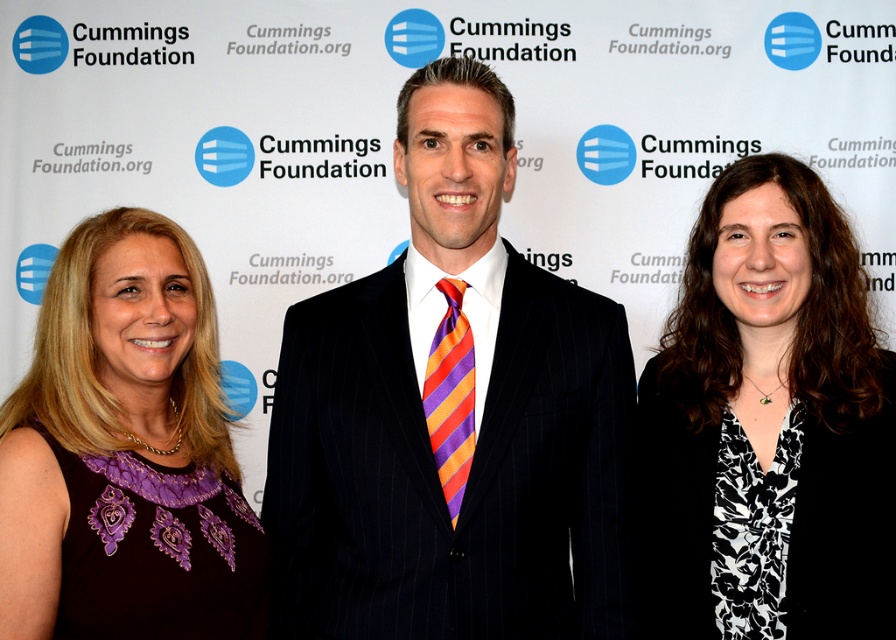
Between black pinstripe suit at center and purple embroidered dress at left, which one has less height?

With less height is purple embroidered dress at left.

Is point (376, 499) farther from camera compared to point (109, 426)?

Yes, it is.

The height and width of the screenshot is (640, 896). What do you see at coordinates (451, 416) in the screenshot? I see `black pinstripe suit at center` at bounding box center [451, 416].

In order to click on black pinstripe suit at center in this screenshot , I will do `click(451, 416)`.

The height and width of the screenshot is (640, 896). Identify the location of black floral dress at right. (768, 426).

Is point (866, 492) farther from camera compared to point (187, 513)?

Yes, it is behind point (187, 513).

This screenshot has width=896, height=640. I want to click on black floral dress at right, so click(x=768, y=426).

Does purple embroidered dress at left appear on the right side of orange and purple striped tie at center?

Incorrect, purple embroidered dress at left is not on the right side of orange and purple striped tie at center.

Is purple embroidered dress at left above orange and purple striped tie at center?

Incorrect, purple embroidered dress at left is not positioned above orange and purple striped tie at center.

This screenshot has width=896, height=640. I want to click on purple embroidered dress at left, so click(x=134, y=442).